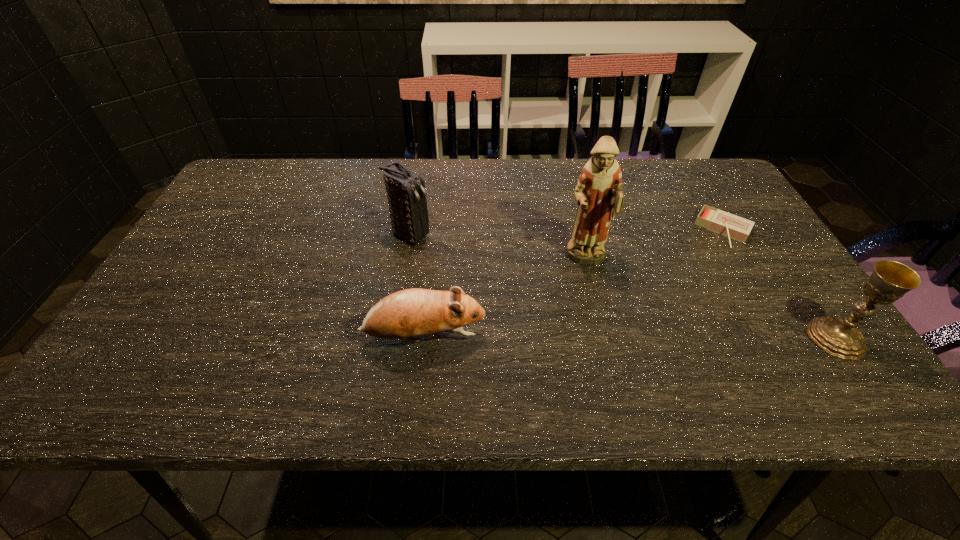
This screenshot has width=960, height=540. I want to click on vacant space on the desktop that is between the hamster and the chalice and is positioned with the zip open on the clutch bag, so click(600, 338).

The height and width of the screenshot is (540, 960). Find the location of `vacant spot on the desktop that is between the second shortest object and the chalice and is positioned on the front-facing side of the figurine`. vacant spot on the desktop that is between the second shortest object and the chalice and is positioned on the front-facing side of the figurine is located at coordinates (604, 338).

Where is `free space on the desktop that is between the fourth tallest object and the chalice and is positioned on the striking surface of the matchbox`? The image size is (960, 540). free space on the desktop that is between the fourth tallest object and the chalice and is positioned on the striking surface of the matchbox is located at coordinates (664, 338).